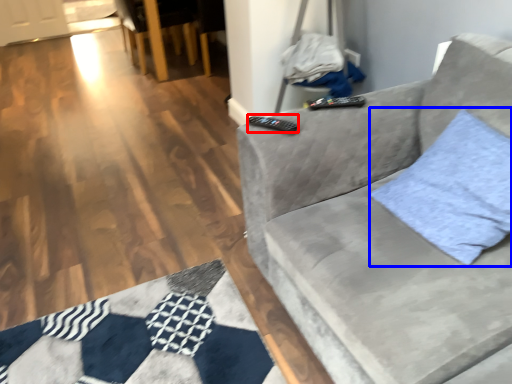
Question: Which of the following is the closest to the observer, remote (highlighted by a red box) or throw pillow (highlighted by a blue box)?

Choices:
 (A) remote
 (B) throw pillow

Answer: (B)